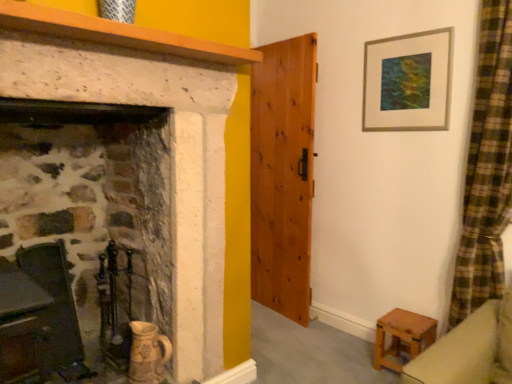
Where is `vacant space in between wooden stool at lower right and natural wood door at center`? The height and width of the screenshot is (384, 512). vacant space in between wooden stool at lower right and natural wood door at center is located at coordinates (338, 334).